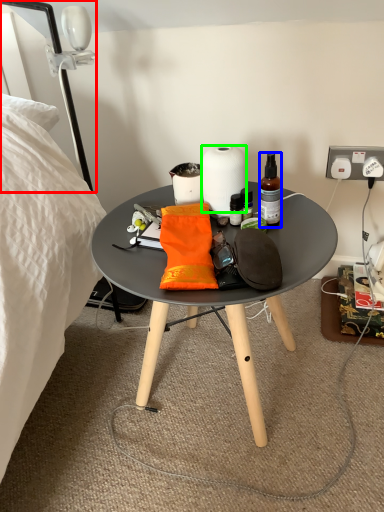
Question: Considering the real-world distances, which object is farthest from lamp (highlighted by a red box)? bottle (highlighted by a blue box) or paper towel (highlighted by a green box)?

Choices:
 (A) bottle
 (B) paper towel

Answer: (A)